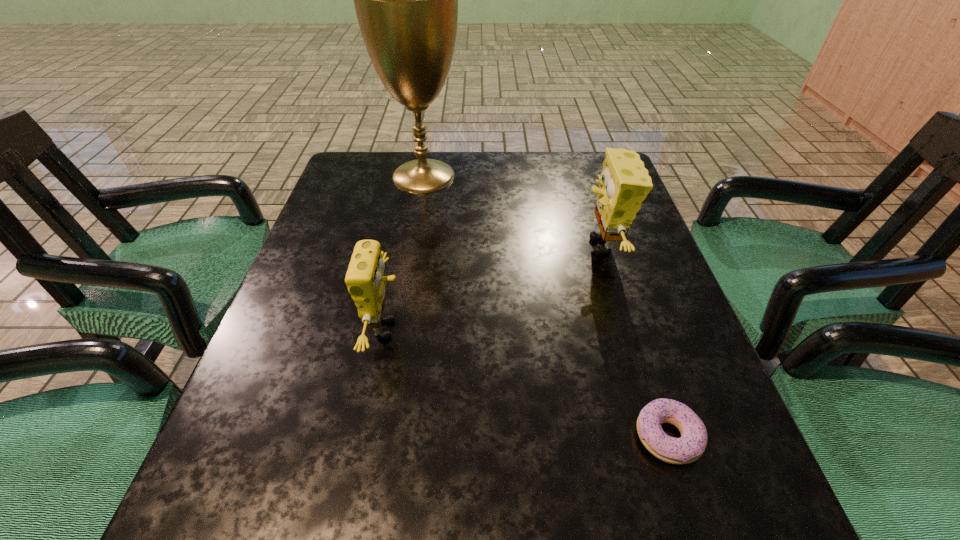
The image size is (960, 540). I want to click on free spot between the trophy cup and the nearest object, so click(x=545, y=306).

Identify the location of unoccupied area between the left sponge and the right sponge. This screenshot has height=540, width=960. (494, 288).

At what (x,y) coordinates should I click in order to perform the action: click on vacant space that is in between the left sponge and the right sponge. Please return your answer as a coordinate pair (x, y). This screenshot has height=540, width=960. Looking at the image, I should click on (494, 288).

What are the coordinates of `empty location between the tallest object and the nearest object` in the screenshot? It's located at (545, 306).

The height and width of the screenshot is (540, 960). I want to click on vacant region between the nearest object and the shorter sponge, so click(x=527, y=383).

This screenshot has height=540, width=960. In order to click on free spot between the farthest object and the shortest object in this screenshot , I will do `click(545, 306)`.

Locate an element on the screen. This screenshot has width=960, height=540. the second closest object to the shorter sponge is located at coordinates (624, 183).

Image resolution: width=960 pixels, height=540 pixels. Identify the location of the closest object to the farthest object. (624, 183).

Locate an element on the screen. This screenshot has height=540, width=960. vacant point that satisfies the following two spatial constraints: 1. on the front side of the farthest object; 2. on the left side of the doughnut is located at coordinates (378, 437).

You are a GUI agent. You are given a task and a screenshot of the screen. Output one action in this format:
    pyautogui.click(x=<x>, y=<y>)
    Task: Click on the free location that satisfies the following two spatial constraints: 1. on the back side of the shortest object; 2. on the face of the right sponge
    This screenshot has height=540, width=960.
    Given the screenshot: What is the action you would take?
    pyautogui.click(x=607, y=246)